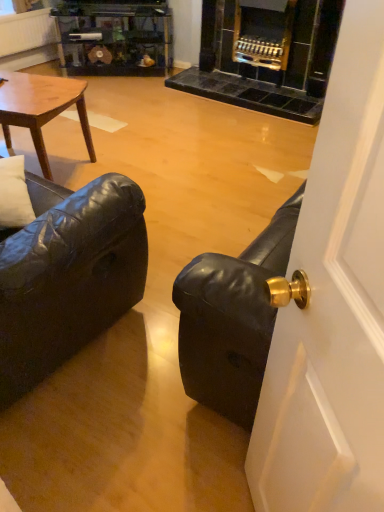
Where is `black leather couch at left`? The image size is (384, 512). black leather couch at left is located at coordinates (67, 275).

Is black leather couch at left at the back of wooden glossy coffee table at upper left?

No, black leather couch at left is not at the back of wooden glossy coffee table at upper left.

Is wooden glossy coffee table at upper left closer to the viewer compared to black leather couch at left?

No, wooden glossy coffee table at upper left is further to the viewer.

Considering the relative sizes of wooden glossy coffee table at upper left and black leather couch at left in the image provided, is wooden glossy coffee table at upper left thinner than black leather couch at left?

Correct, the width of wooden glossy coffee table at upper left is less than that of black leather couch at left.

At what (x,y) coordinates should I click in order to perform the action: click on studio couch below the wooden glossy coffee table at upper left (from the image's perspective). Please return your answer as a coordinate pair (x, y). Looking at the image, I should click on (67, 275).

Locate an element on the screen. studio couch behind the black leather couch at right is located at coordinates (67, 275).

Is black leather couch at right far away from black leather couch at left?

That's not correct — black leather couch at right is a little close to black leather couch at left.

Where is `door in front of the wooden glossy coffee table at upper left`? door in front of the wooden glossy coffee table at upper left is located at coordinates 333,304.

Is wooden glossy coffee table at upper left not within black leather couch at right?

That's correct, wooden glossy coffee table at upper left is outside of black leather couch at right.

Is point (40, 139) closer or farther from the camera than point (350, 257)?

Point (40, 139) is farther from the camera than point (350, 257).

Between black leather couch at right and wooden glossy coffee table at upper left, which one has less height?

With less height is wooden glossy coffee table at upper left.

Which object is thinner, black leather couch at right or wooden glossy coffee table at upper left?

Thinner between the two is wooden glossy coffee table at upper left.

From a real-world perspective, is black leather couch at right located beneath wooden glossy coffee table at upper left?

No.

In the scene shown: From the image's perspective, which one is positioned higher, black leather couch at left or black leather couch at right?

black leather couch at left.

Between black leather couch at left and black leather couch at right, which one is positioned behind?

black leather couch at left is behind.

Can you tell me how much black leather couch at left and black leather couch at right differ in facing direction?

There is a 91.3-degree angle between the facing directions of black leather couch at left and black leather couch at right.

Is black leather couch at left further to the viewer compared to wooden glossy coffee table at upper left?

That is False.

Which is in front, point (81, 248) or point (10, 140)?

The point (81, 248) is closer to the camera.

Is black leather couch at left located outside wooden glossy coffee table at upper left?

black leather couch at left lies outside wooden glossy coffee table at upper left's area.

From a real-world perspective, who is located higher, black leather couch at left or wooden glossy coffee table at upper left?

From a 3D spatial view, black leather couch at left is above.

Locate an element on the screen. This screenshot has width=384, height=512. studio couch lying below the wooden glossy coffee table at upper left (from the image's perspective) is located at coordinates point(67,275).

Image resolution: width=384 pixels, height=512 pixels. Find the location of `studio couch below the black leather couch at right (from a real-world perspective)`. studio couch below the black leather couch at right (from a real-world perspective) is located at coordinates (67, 275).

Estimate the real-world distances between objects in this image. Which object is closer to black leather couch at left, black leather couch at right or wooden glossy coffee table at upper left?

black leather couch at right lies closer to black leather couch at left than the other object.

When comparing their distances from black leather couch at right, does wooden glossy coffee table at upper left or black leather couch at left seem closer?

black leather couch at left is positioned closer to the anchor black leather couch at right.

Considering their positions, is black leather couch at left positioned closer to wooden glossy coffee table at upper left than black leather couch at right?

black leather couch at left lies closer to wooden glossy coffee table at upper left than the other object.

From the image, which object appears to be farther from wooden glossy coffee table at upper left, black leather couch at right or black leather couch at left?

black leather couch at right is further to wooden glossy coffee table at upper left.

Looking at the image, which one is located closer to black leather couch at left, wooden glossy coffee table at upper left or black leather couch at right?

Among the two, black leather couch at right is located nearer to black leather couch at left.

Looking at the image, which one is located further to black leather couch at right, black leather couch at left or wooden glossy coffee table at upper left?

Based on the image, wooden glossy coffee table at upper left appears to be further to black leather couch at right.

Identify the location of studio couch between black leather couch at right and wooden glossy coffee table at upper left from front to back. (67, 275).